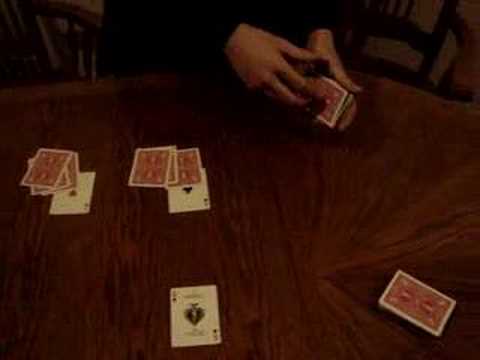
Locate an element on the screen. This screenshot has height=360, width=480. box is located at coordinates (422, 298).